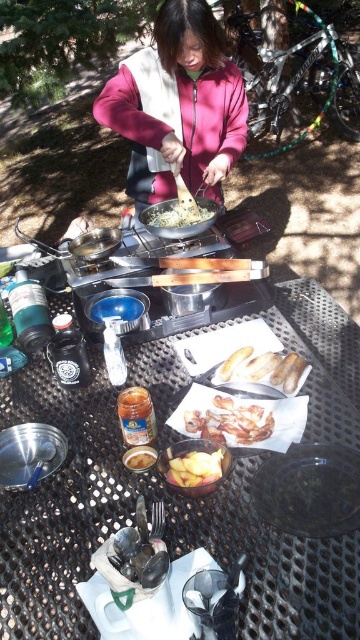
Question: Can you confirm if black metal table at center is positioned to the left of yellow matte potato at center?

Choices:
 (A) yes
 (B) no

Answer: (B)

Question: Considering the real-world distances, which object is closest to the golden brown bread at center?

Choices:
 (A) yellow matte food at center
 (B) black metal table at center
 (C) shiny golden shrimp at center

Answer: (C)

Question: Where is black metal table at center located in relation to shiny golden shrimp at center in the image?

Choices:
 (A) left
 (B) right

Answer: (A)

Question: Which point is farther from the camera taking this photo?

Choices:
 (A) (259, 628)
 (B) (285, 483)
 (C) (213, 456)

Answer: (C)

Question: Does black matte platter at lower right appear over shiny golden shrimp at center?

Choices:
 (A) yes
 (B) no

Answer: (B)

Question: Among these points, which one is farthest from the camera?

Choices:
 (A) (356, 499)
 (B) (243, 352)
 (C) (33, 464)
 (D) (183, 208)

Answer: (D)